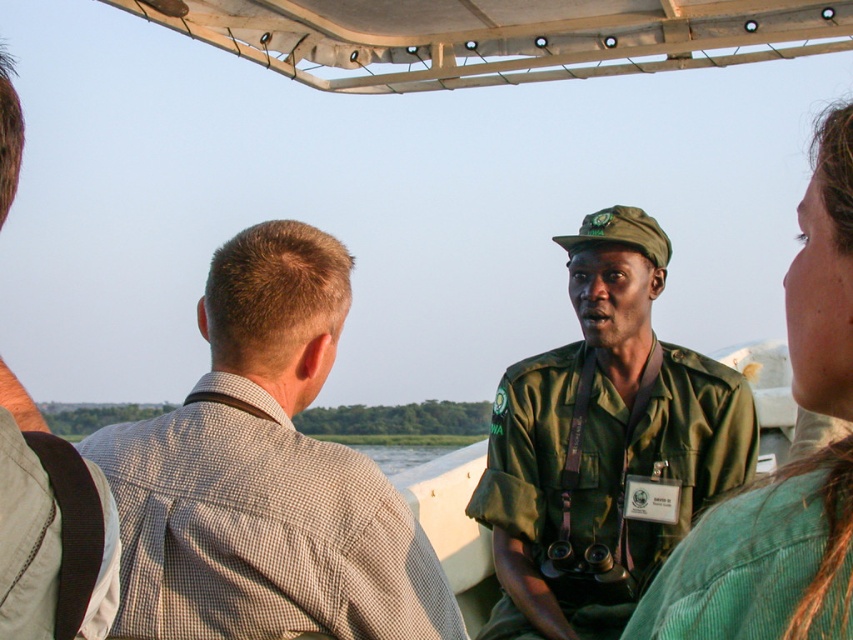
Where is `brown checkered shirt at left`? brown checkered shirt at left is located at coordinates (265, 476).

Is point (223, 378) behind point (42, 428)?

Yes.

Who is more forward, (x=271, y=236) or (x=38, y=573)?

Positioned in front is point (x=38, y=573).

This screenshot has height=640, width=853. Identify the location of brown checkered shirt at left. point(265,476).

Between green corduroy shirt at center and light brown fabric shirt at left, which one appears on the left side from the viewer's perspective?

Positioned to the left is light brown fabric shirt at left.

Does point (786, 547) come behind point (7, 572)?

Yes, point (786, 547) is behind point (7, 572).

Where is `green corduroy shirt at center`? This screenshot has height=640, width=853. green corduroy shirt at center is located at coordinates (762, 561).

Who is higher up, brown checkered shirt at left or green matte uniform at center?

brown checkered shirt at left

Is point (323, 609) behind point (599, 566)?

That is False.

At what (x,y) coordinates should I click in order to perform the action: click on brown checkered shirt at left. Please return your answer as a coordinate pair (x, y). This screenshot has width=853, height=640. Looking at the image, I should click on (265, 476).